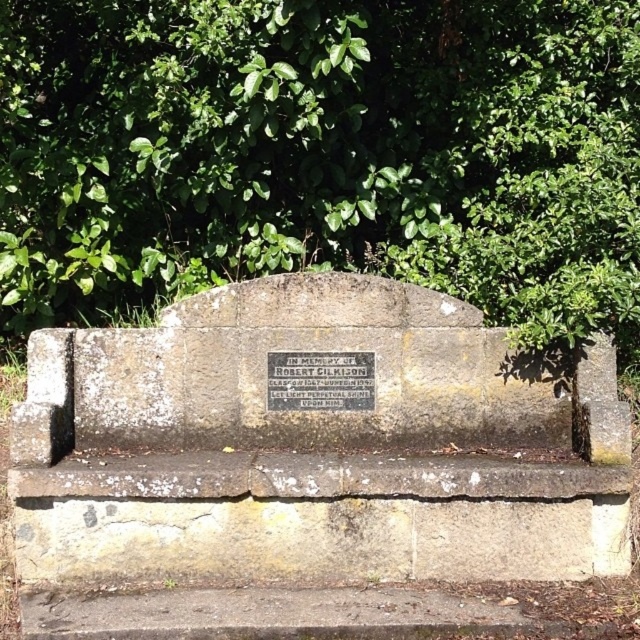
You are a photographer standing in front of the stone bench. You want to focus on the plaque on the bench. Which of the two points, point (436, 77) or point (353, 380), is closer to your camera lens?

Point (436, 77) is further to the camera than point (353, 380), so the point closer to your camera lens is point (353, 380).

You are a visitor at a park and see the green leafy tree at upper center and the silver metallic plaque at center. Which object is closer to you?

The green leafy tree at upper center is closer to you because it is in front of the silver metallic plaque at center.

You are standing in front of the stone bench and want to place a small flower at one of the two points marked on the bench. The first point is at coordinates point(177, 84) and the second is at point(316, 304). Which point is closer to you?

Point(177, 84) is closer to you because it is further to the viewer than point(316, 304).